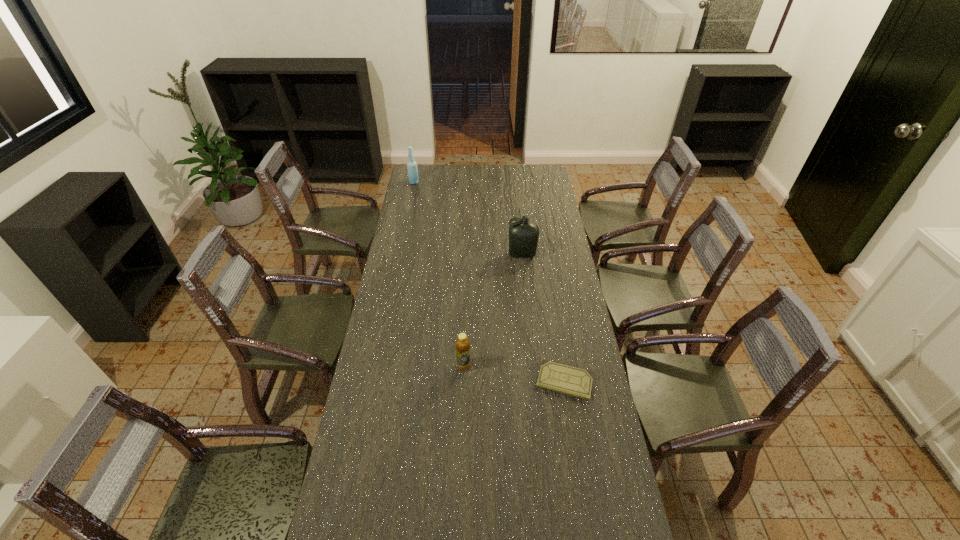
You are a GUI agent. You are given a task and a screenshot of the screen. Output one action in this format:
    pyautogui.click(x=<x>, y=<y>)
    Task: Click on the free space between the second farthest bottle and the farthest bottle
    The height and width of the screenshot is (540, 960).
    Given the screenshot: What is the action you would take?
    pyautogui.click(x=468, y=219)

Identify the location of vacant area that lies between the nearest bottle and the farthest bottle. (439, 274).

You are a GUI agent. You are given a task and a screenshot of the screen. Output one action in this format:
    pyautogui.click(x=<x>, y=<y>)
    Task: Click on the free space between the third nearest object and the shortest object
    The width and height of the screenshot is (960, 540).
    Given the screenshot: What is the action you would take?
    pyautogui.click(x=543, y=318)

Locate an element on the screen. The image size is (960, 540). free area in between the second farthest bottle and the shortest bottle is located at coordinates (492, 310).

Where is `vacant area that lies between the third tallest object and the shortest object`? Image resolution: width=960 pixels, height=540 pixels. vacant area that lies between the third tallest object and the shortest object is located at coordinates [515, 374].

I want to click on free spot between the shortest object and the third nearest object, so click(543, 318).

Image resolution: width=960 pixels, height=540 pixels. I want to click on vacant space that's between the second farthest bottle and the second object from left to right, so click(x=492, y=310).

The image size is (960, 540). I want to click on free space between the farthest object and the checkbook, so pyautogui.click(x=490, y=281).

This screenshot has width=960, height=540. Identify the location of free space between the shortest object and the rightmost bottle. click(543, 318).

I want to click on vacant space in between the leftmost object and the second farthest object, so click(468, 219).